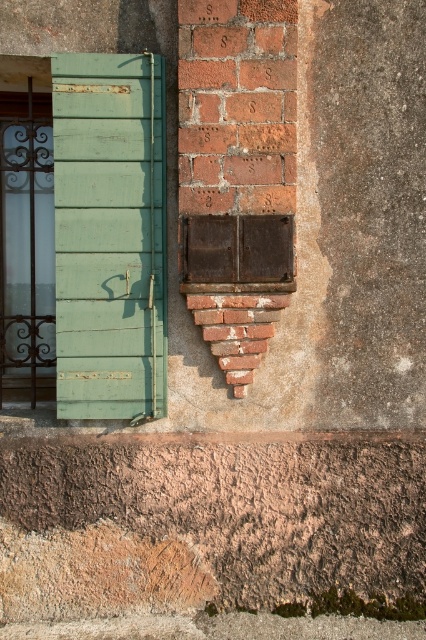
Question: Can you confirm if green painted wood at left is wider than rusty metal window at center?

Choices:
 (A) yes
 (B) no

Answer: (B)

Question: Which point is closer to the camera?

Choices:
 (A) (138, 384)
 (B) (189, 248)

Answer: (B)

Question: Does green painted wood at left have a greater width compared to rusty metal window at center?

Choices:
 (A) no
 (B) yes

Answer: (A)

Question: Can you confirm if green painted wood at left is positioned to the right of rusty metal window at center?

Choices:
 (A) no
 (B) yes

Answer: (A)